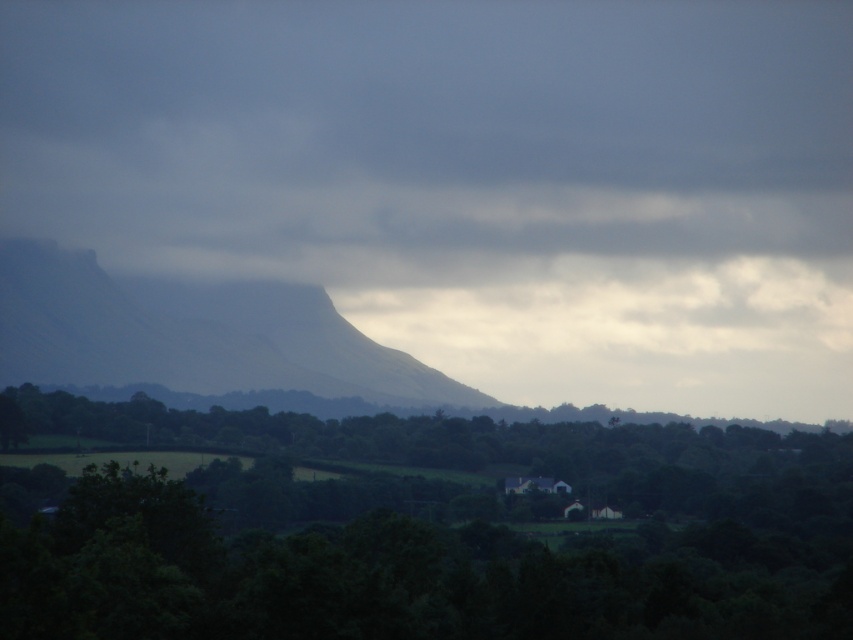
Question: Which point is farther to the camera?

Choices:
 (A) gray foggy mountain at center
 (B) green leafy tree at center

Answer: (A)

Question: Considering the relative positions of green leafy tree at center and gray foggy mountain at center in the image provided, where is green leafy tree at center located with respect to gray foggy mountain at center?

Choices:
 (A) right
 (B) left

Answer: (A)

Question: Among these objects, which one is nearest to the camera?

Choices:
 (A) green leafy tree at center
 (B) gray foggy mountain at center

Answer: (A)

Question: Is green leafy tree at center closer to camera compared to gray foggy mountain at center?

Choices:
 (A) no
 (B) yes

Answer: (B)

Question: Is green leafy tree at center positioned in front of gray foggy mountain at center?

Choices:
 (A) no
 (B) yes

Answer: (B)